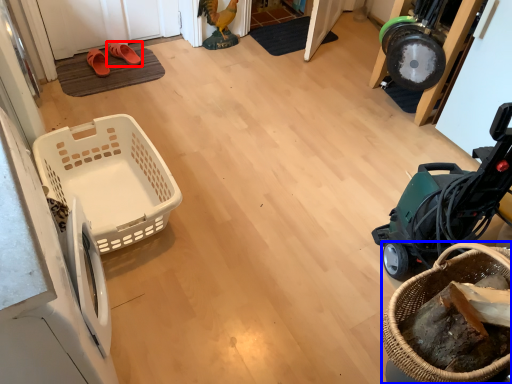
Question: Which object appears farthest to the camera in this image, footwear (highlighted by a red box) or basket (highlighted by a blue box)?

Choices:
 (A) footwear
 (B) basket

Answer: (A)